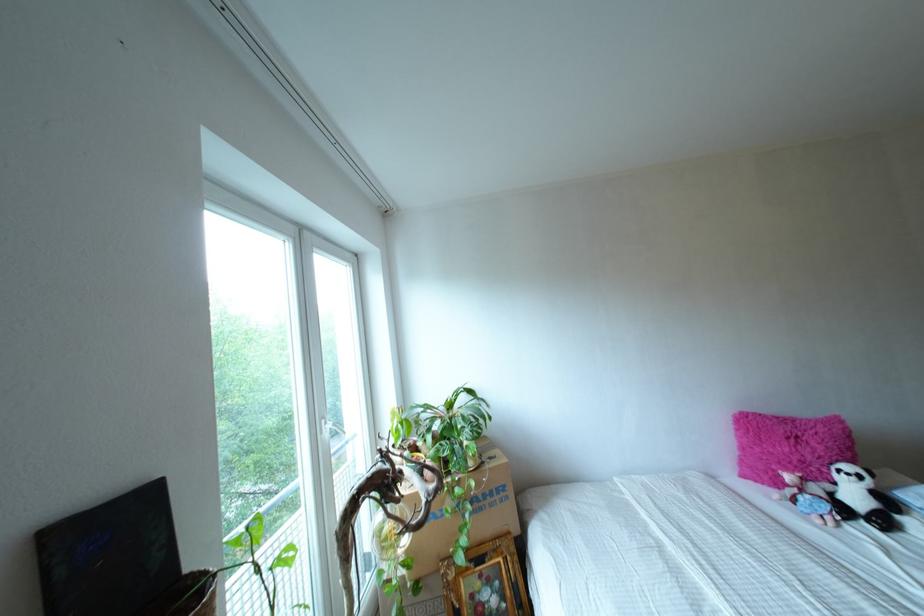
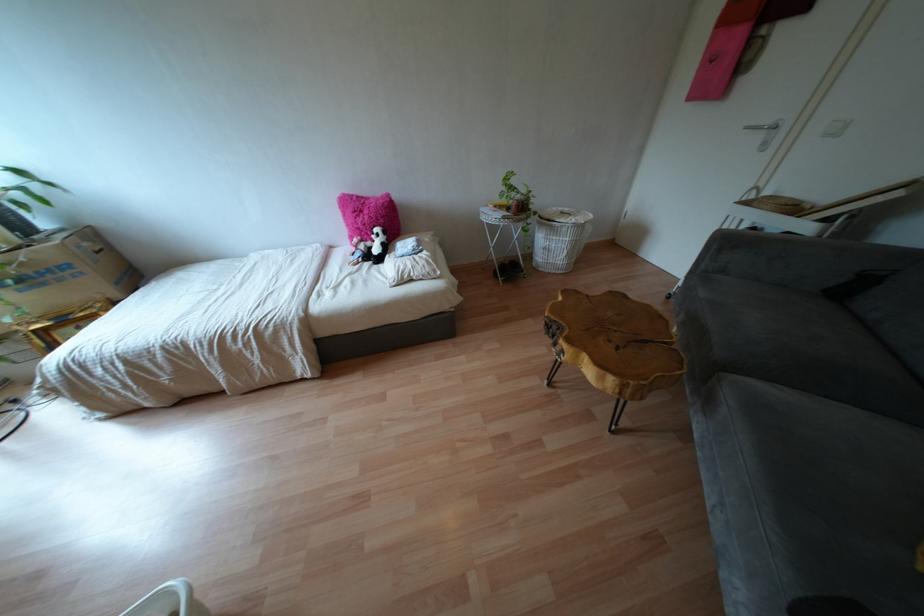
Find the pixel in the second image that matches (x=886, y=553) in the first image.

(349, 274)